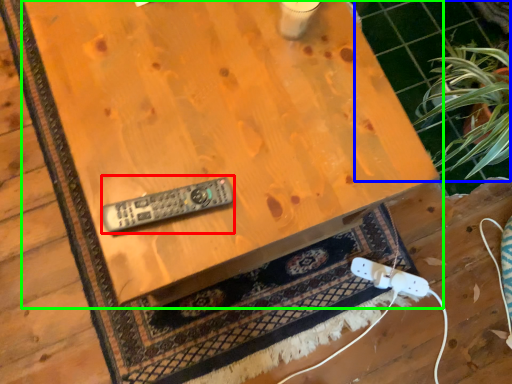
Question: Estimate the real-world distances between objects in this image. Which object is farther from control (highlighted by a red box), tile (highlighted by a blue box) or table (highlighted by a green box)?

Choices:
 (A) tile
 (B) table

Answer: (A)